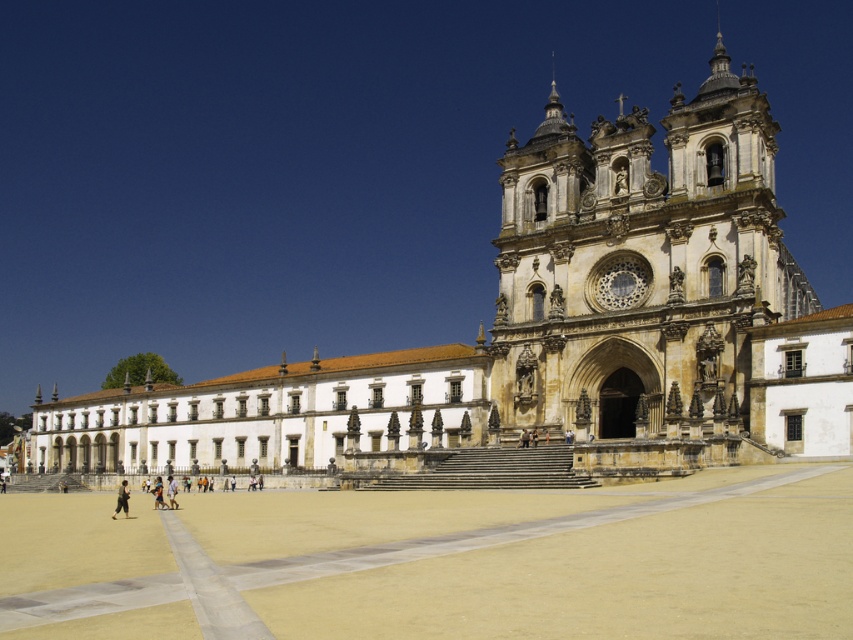
You are a construction worker planning to install a new walkway between the white stone church at center and the beige stone tower at center. The walkway must be 20 meters long to accommodate all visitors. Based on the scene, will the proposed walkway length be sufficient?

The distance between the white stone church at center and the beige stone tower at center is 23.14 meters. Since the proposed walkway is only 20 meters long, it will not be sufficient to cover the required distance between them.

You are standing in front of the cathedral and want to locate two specific points marked on the facade. The first point is at coordinates point (723, 369) and the second is at point (111, 516). Which point appears closer to you when observing the building from the front?

Point (723, 369) is further to the viewer than point (111, 516), so the first point is closer to you.

You are standing at the point with coordinates (374, 170). What is the name of the building you are currently at?

The point (374, 170) corresponds to the white stone church at center, so you are at the white stone church at center.